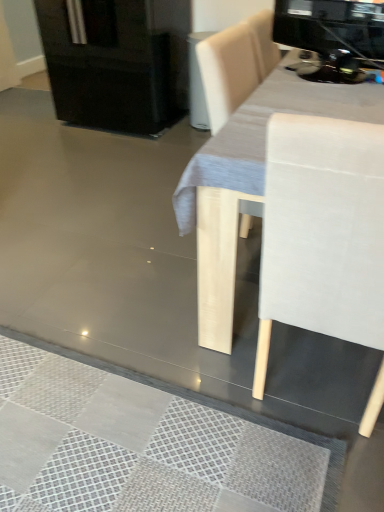
Question: Is black glossy fridge at upper left placed right next to black glossy coffee machine at upper right?

Choices:
 (A) no
 (B) yes

Answer: (A)

Question: Does black glossy fridge at upper left have a lesser height compared to black glossy coffee machine at upper right?

Choices:
 (A) no
 (B) yes

Answer: (A)

Question: Is black glossy fridge at upper left aimed at black glossy coffee machine at upper right?

Choices:
 (A) no
 (B) yes

Answer: (A)

Question: From the image's perspective, is black glossy fridge at upper left located above black glossy coffee machine at upper right?

Choices:
 (A) yes
 (B) no

Answer: (A)

Question: Is black glossy fridge at upper left facing away from black glossy coffee machine at upper right?

Choices:
 (A) yes
 (B) no

Answer: (B)

Question: Considering the relative sizes of black glossy fridge at upper left and black glossy coffee machine at upper right in the image provided, is black glossy fridge at upper left wider than black glossy coffee machine at upper right?

Choices:
 (A) no
 (B) yes

Answer: (B)

Question: Would you say black glossy fridge at upper left is part of black glossy coffee machine at upper right's contents?

Choices:
 (A) yes
 (B) no

Answer: (B)

Question: From the image's perspective, would you say black glossy coffee machine at upper right is positioned over black glossy fridge at upper left?

Choices:
 (A) no
 (B) yes

Answer: (A)

Question: Is black glossy coffee machine at upper right closer to the viewer compared to black glossy fridge at upper left?

Choices:
 (A) no
 (B) yes

Answer: (B)

Question: Are black glossy coffee machine at upper right and black glossy fridge at upper left located far from each other?

Choices:
 (A) no
 (B) yes

Answer: (B)

Question: Considering the relative sizes of black glossy coffee machine at upper right and black glossy fridge at upper left in the image provided, is black glossy coffee machine at upper right smaller than black glossy fridge at upper left?

Choices:
 (A) yes
 (B) no

Answer: (A)

Question: Can you confirm if black glossy coffee machine at upper right is positioned to the left of black glossy fridge at upper left?

Choices:
 (A) yes
 (B) no

Answer: (B)

Question: In the image, is black glossy fridge at upper left positioned in front of or behind black glossy coffee machine at upper right?

Choices:
 (A) behind
 (B) front

Answer: (A)